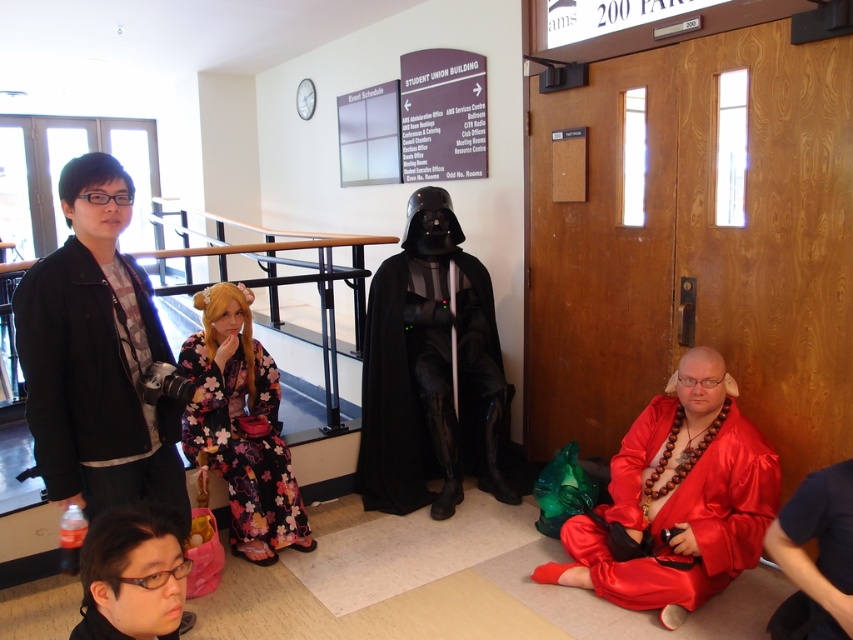
Question: Among these objects, which one is nearest to the camera?

Choices:
 (A) black matte/soft darth vader costume at center
 (B) matte black glasses at lower left
 (C) black matte jacket at left

Answer: (B)

Question: Among these points, which one is farthest from the camera?

Choices:
 (A) (619, 458)
 (B) (16, 305)

Answer: (A)

Question: Does floral kimono at center have a greater width compared to matte black glasses at lower left?

Choices:
 (A) yes
 (B) no

Answer: (A)

Question: Estimate the real-world distances between objects in this image. Which object is farther from the black matte jacket at left?

Choices:
 (A) matte black glasses at lower left
 (B) silky red robe at lower left
 (C) black matte/soft darth vader costume at center

Answer: (C)

Question: In this image, where is black matte jacket at left located relative to matte black glasses at lower left?

Choices:
 (A) right
 (B) left

Answer: (B)

Question: Where is satin red kimono at lower right located in relation to matte black glasses at lower left in the image?

Choices:
 (A) right
 (B) left

Answer: (A)